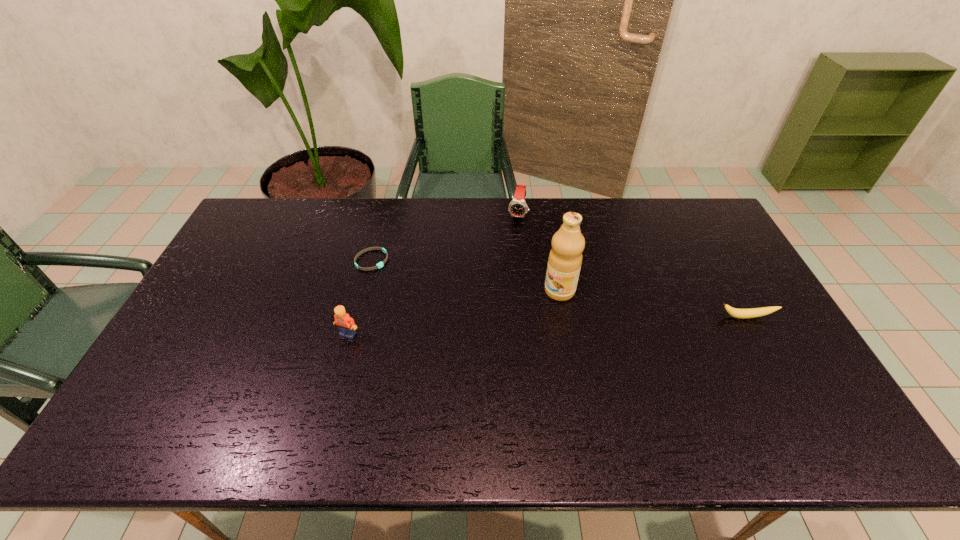
Where is `the nearest object`? Image resolution: width=960 pixels, height=540 pixels. the nearest object is located at coordinates (346, 325).

In order to click on the rightmost object in this screenshot , I will do `click(734, 312)`.

You are a GUI agent. You are given a task and a screenshot of the screen. Output one action in this format:
    pyautogui.click(x=<x>, y=<y>)
    Task: Click on the fourth tallest object
    This screenshot has width=960, height=540.
    Given the screenshot: What is the action you would take?
    pyautogui.click(x=734, y=312)

Image resolution: width=960 pixels, height=540 pixels. Find the location of `the tallest object`. the tallest object is located at coordinates (565, 258).

Find the location of a particular element. The width and height of the screenshot is (960, 540). olive oil is located at coordinates (565, 258).

Locate an element on the screen. the third object from left to right is located at coordinates (518, 208).

Find the location of `watch`. watch is located at coordinates (518, 208).

Where is `the shortest object`? This screenshot has height=540, width=960. the shortest object is located at coordinates (380, 264).

Find the location of a particular element. This screenshot has width=960, height=540. wristband is located at coordinates (380, 264).

In order to click on vacant space located 0.110m on the front-facing side of the nearest object in this screenshot , I will do `click(337, 374)`.